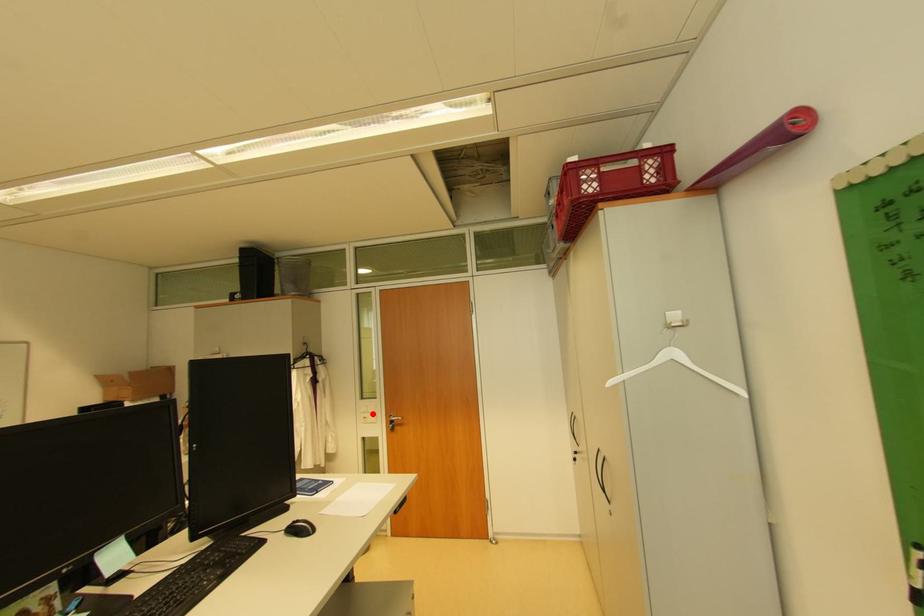
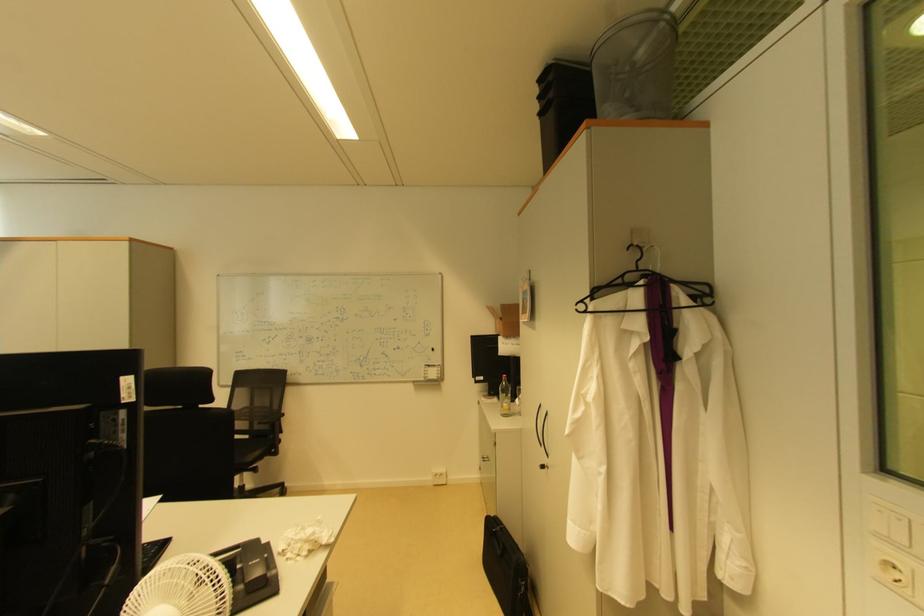
Question: I am providing you with two images of the same scene from different viewpoints. Image1 has a red point marked. In image2, the corresponding 3D location appears at what relative position? Reply with the corresponding letter.

Choices:
 (A) Closer
 (B) Farther

Answer: (A)